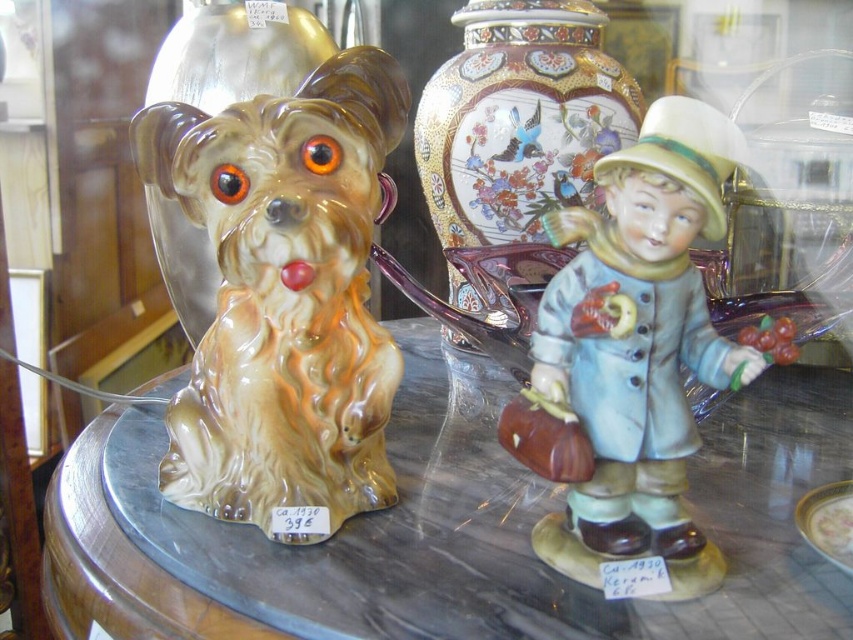
You are standing in front of a display case with a ceramic dog figurine. The point where you are looking at is at coordinates point (288, 317). If the display case is 24 inches tall, can you see the top of the ceramic dog figurine from your current position?

The point (288, 317) is 20.85 inches away from the viewer. Since the display case is 24 inches tall, the top of the ceramic dog figurine is within the visible height of the case, so yes, you can see the top of the ceramic dog figurine from your current position.

You are a customer in an antique shop and want to locate the matte ceramic dog at left. Based on the coordinates provided, where should you look within the display case?

The matte ceramic dog at left is located at coordinates point (283,298) within the display case.